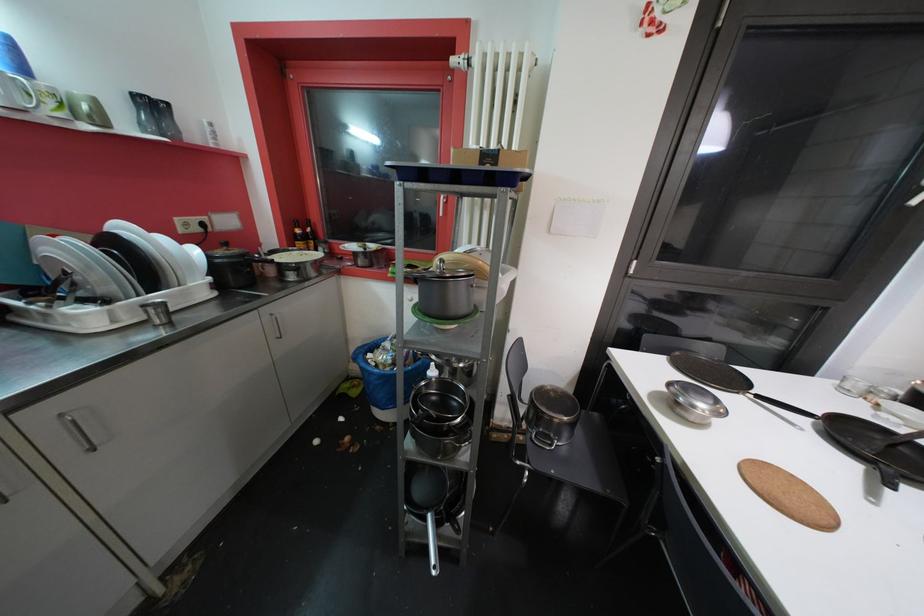
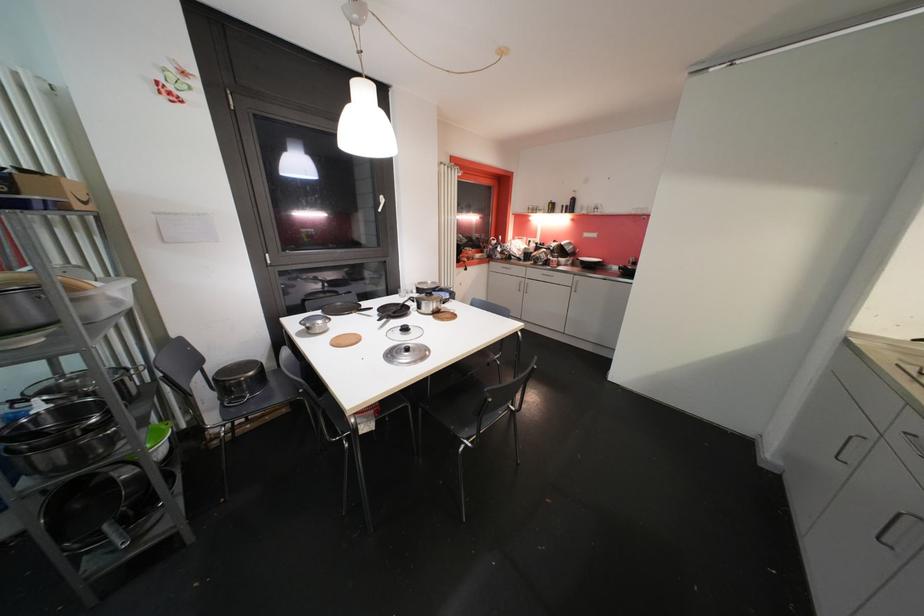
Where in the second image is the point corresponding to (584,429) from the first image?

(274, 379)